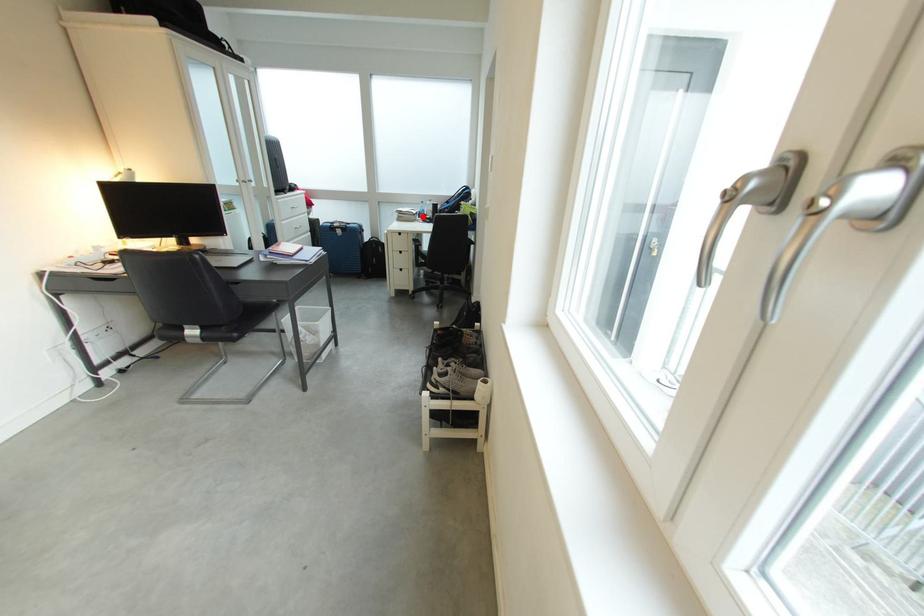
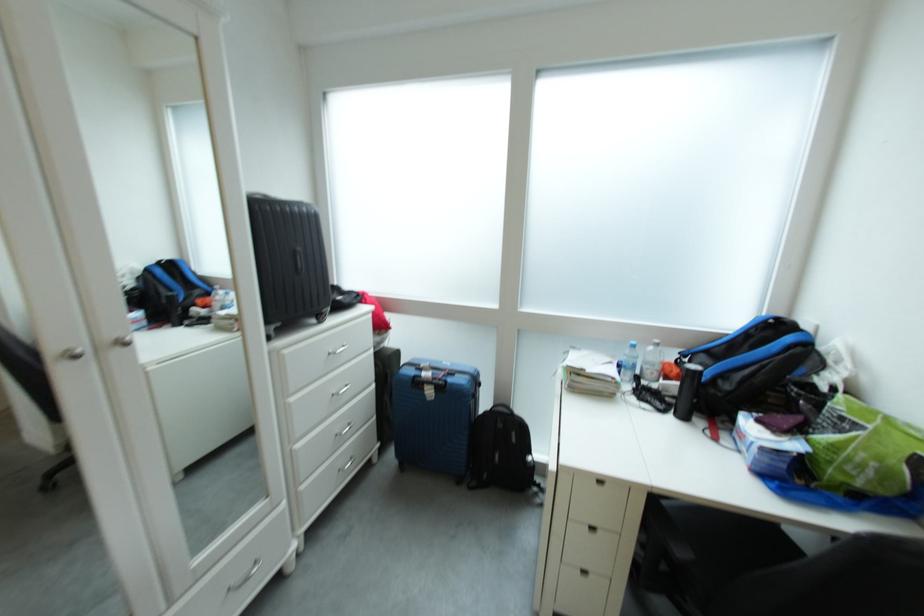
Question: I am providing you with two images of the same scene from different viewpoints. A red point is shown in image1. For the corresponding object point in image2, is it positioned nearer or farther from the camera?

Choices:
 (A) Nearer
 (B) Farther

Answer: (B)